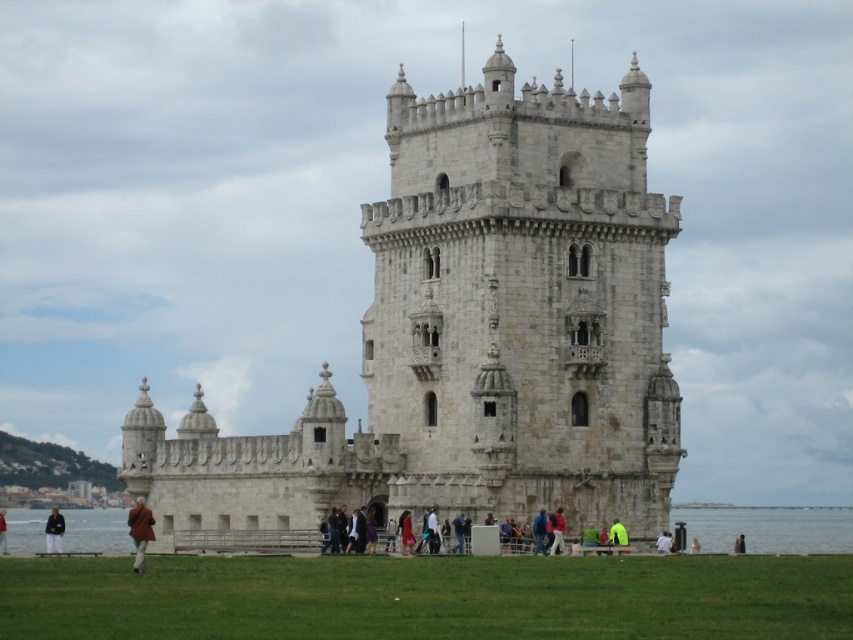
Question: Is brown leather jacket at lower left closer to the viewer compared to white fabric person at center?

Choices:
 (A) yes
 (B) no

Answer: (B)

Question: Which point is farther to the camera?

Choices:
 (A) clear water at lower center
 (B) neon yellow jacket at lower center
 (C) brown leather jacket at lower left
 (D) blue fabric jacket at center

Answer: (C)

Question: Which object is positioned farthest from the neon yellow jacket at lower center?

Choices:
 (A) brown leather jacket at lower left
 (B) blue fabric jacket at center
 (C) brown leather jacket at lower center
 (D) white fabric person at center

Answer: (A)

Question: Does dark brown leather jacket at lower left have a lesser width compared to blue fabric jacket at center?

Choices:
 (A) yes
 (B) no

Answer: (B)

Question: Can you confirm if brown wool coat at lower left is positioned below red fabric jacket at center?

Choices:
 (A) no
 (B) yes

Answer: (B)

Question: Which point appears farthest from the camera in this image?

Choices:
 (A) (830, 532)
 (B) (555, 531)
 (C) (0, 531)

Answer: (A)